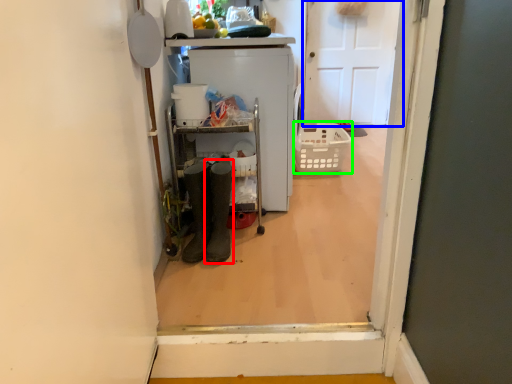
Question: Which object is the farthest from footwear (highlighted by a red box)? Choose among these: door (highlighted by a blue box) or basket (highlighted by a green box).

Choices:
 (A) door
 (B) basket

Answer: (A)